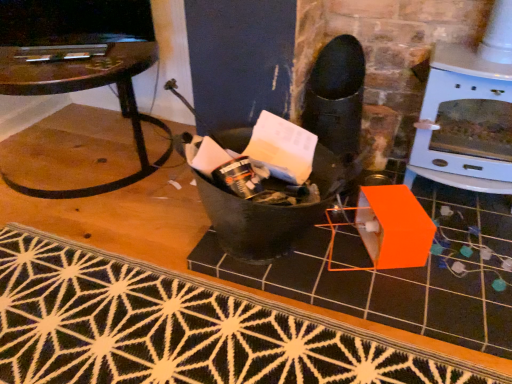
Locate an element on the screen. This screenshot has width=512, height=384. unoccupied area behind black textured rug at lower center is located at coordinates (113, 177).